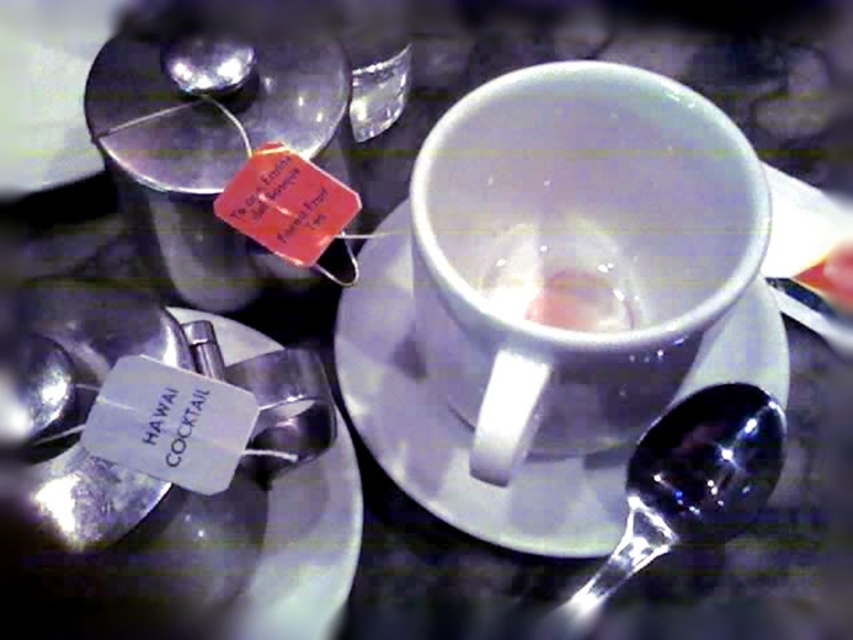
Can you confirm if white glossy mug at center is smaller than shiny silver spoon at lower right?

Actually, white glossy mug at center might be larger than shiny silver spoon at lower right.

Does white glossy mug at center appear under shiny silver spoon at lower right?

No, white glossy mug at center is not below shiny silver spoon at lower right.

What do you see at coordinates (577, 250) in the screenshot? I see `white glossy mug at center` at bounding box center [577, 250].

Locate an element on the screen. The image size is (853, 640). white glossy mug at center is located at coordinates (577, 250).

Does white paper tag at lower left appear over shiny silver spoon at lower right?

Correct, white paper tag at lower left is located above shiny silver spoon at lower right.

Does white paper tag at lower left appear on the left side of shiny silver spoon at lower right?

Indeed, white paper tag at lower left is positioned on the left side of shiny silver spoon at lower right.

At what (x,y) coordinates should I click in order to perform the action: click on white paper tag at lower left. Please return your answer as a coordinate pair (x, y). This screenshot has height=640, width=853. Looking at the image, I should click on (184, 550).

Identify the location of white paper tag at lower left. The width and height of the screenshot is (853, 640). (184, 550).

Can you confirm if white paper tag at lower left is positioned to the left of clear glass cup at center?

Yes, white paper tag at lower left is to the left of clear glass cup at center.

Is white paper tag at lower left to the right of clear glass cup at center from the viewer's perspective?

In fact, white paper tag at lower left is to the left of clear glass cup at center.

Is point (358, 531) farther from viewer compared to point (532, 262)?

That is False.

You are a GUI agent. You are given a task and a screenshot of the screen. Output one action in this format:
    pyautogui.click(x=<x>, y=<y>)
    Task: Click on the white paper tag at lower left
    
    Given the screenshot: What is the action you would take?
    (184, 550)